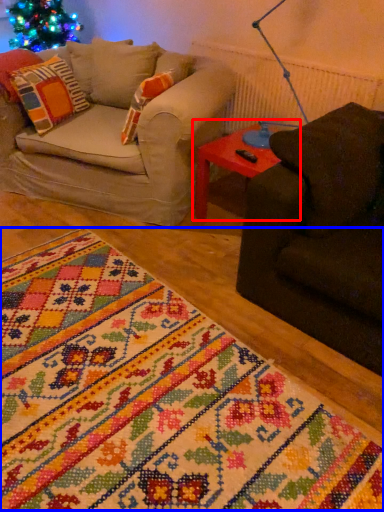
Question: Which object appears farthest to the camera in this image, table (highlighted by a red box) or blanket (highlighted by a blue box)?

Choices:
 (A) table
 (B) blanket

Answer: (A)